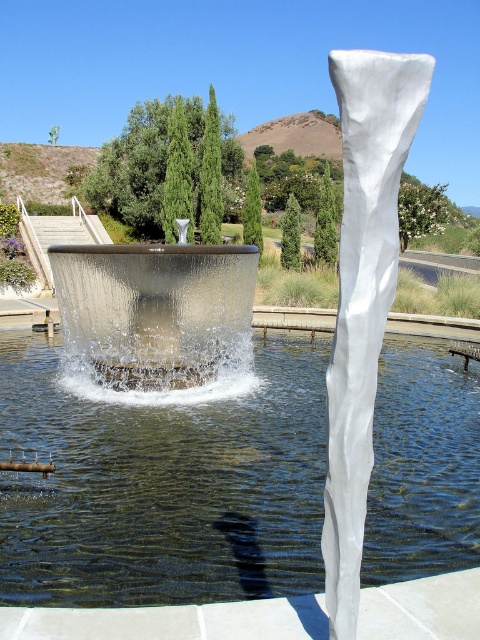
You are a landscape architect designing a garden pathway around the clear glass pool at center and the translucent glass water at center. Since both are at the center, how should you arrange the pathway to avoid overlapping them?

The clear glass pool at center occupies less space than the translucent glass water at center, so the pathway should be designed around the larger area of the translucent glass water at center to ensure both are accommodated without overlapping.

You are a landscape architect designing a pathway between the clear glass pool at center and the translucent glass water at center. What is the minimum width the pathway should be to accommodate a standard garden cart that is 2.5 meters wide?

The clear glass pool at center and the translucent glass water at center are 3.24 meters apart from each other. Subtracting the garden cart width of 2.5 meters, the minimum pathway width needed would be 3.24 meters minus 2.5 meters, resulting in 0.74 meters. However, this calculation assumes the cart can navigate the space without needing additional clearance. For safety, a wider pathway is recommended.